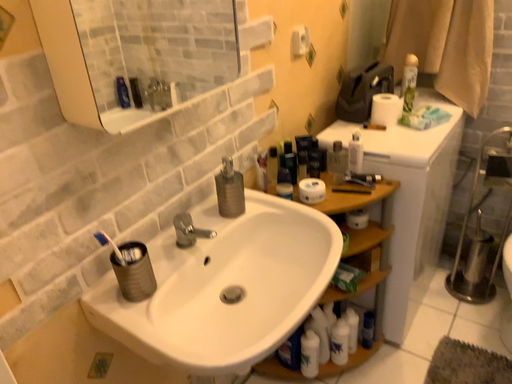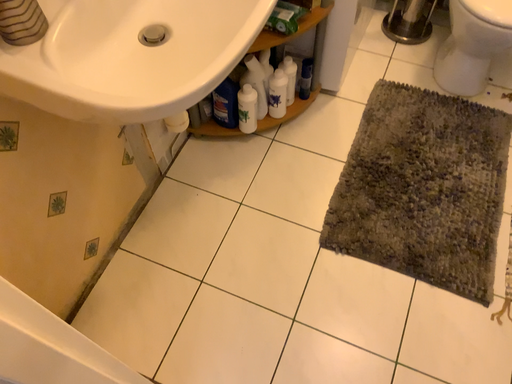
Question: Which way did the camera rotate in the video?

Choices:
 (A) rotated left
 (B) rotated right

Answer: (B)